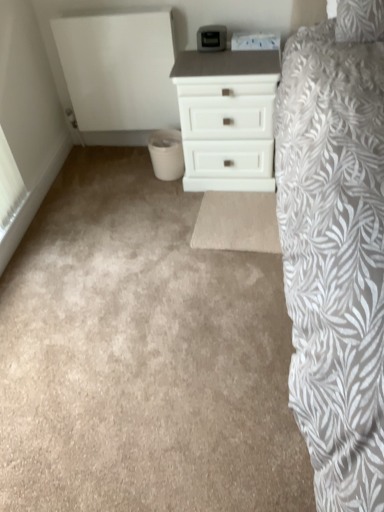
The width and height of the screenshot is (384, 512). Find the location of `white matte chest of drawers at center`. white matte chest of drawers at center is located at coordinates (227, 116).

The width and height of the screenshot is (384, 512). What do you see at coordinates (227, 116) in the screenshot?
I see `white matte chest of drawers at center` at bounding box center [227, 116].

Measure the distance between point (197,93) and camera.

Point (197,93) is 6.32 feet away from camera.

In order to click on beige carpet at center in this screenshot , I will do `click(142, 356)`.

Describe the element at coordinates (142, 356) in the screenshot. I see `beige carpet at center` at that location.

Locate an element on the screen. This screenshot has height=512, width=384. white matte chest of drawers at center is located at coordinates (227, 116).

Is beige carpet at center to the left of white matte chest of drawers at center from the viewer's perspective?

Yes.

Considering the relative positions of beige carpet at center and white matte chest of drawers at center in the image provided, is beige carpet at center behind white matte chest of drawers at center?

No, beige carpet at center is in front of white matte chest of drawers at center.

Is point (198, 435) farther from viewer compared to point (245, 91)?

No, (198, 435) is in front of (245, 91).

From the image's perspective, between beige carpet at center and white matte chest of drawers at center, which one is located above?

From the image's view, white matte chest of drawers at center is above.

From a real-world perspective, is beige carpet at center above or below white matte chest of drawers at center?

Clearly, from a real-world perspective, beige carpet at center is below white matte chest of drawers at center.

Based on the photo, which of these two, beige carpet at center or white matte chest of drawers at center, is wider?

Wider between the two is beige carpet at center.

Is beige carpet at center shorter than white matte chest of drawers at center?

Correct, beige carpet at center is not as tall as white matte chest of drawers at center.

Consider the image. Who is smaller, beige carpet at center or white matte chest of drawers at center?

Smaller between the two is white matte chest of drawers at center.

Is beige carpet at center situated inside white matte chest of drawers at center or outside?

beige carpet at center lies outside white matte chest of drawers at center.

Looking at this image, is beige carpet at center far from white matte chest of drawers at center?

They are positioned close to each other.

Is beige carpet at center facing towards white matte chest of drawers at center?

No.

What's the angular difference between beige carpet at center and white matte chest of drawers at center's facing directions?

The angle between the facing direction of beige carpet at center and the facing direction of white matte chest of drawers at center is 3.6 degrees.

This screenshot has width=384, height=512. I want to click on plain that is under the white matte chest of drawers at center (from a real-world perspective), so click(x=142, y=356).

Considering the positions of objects white matte chest of drawers at center and beige carpet at center in the image provided, who is more to the left, white matte chest of drawers at center or beige carpet at center?

beige carpet at center.

Does white matte chest of drawers at center come in front of beige carpet at center?

No, white matte chest of drawers at center is further to the viewer.

Considering the points (243, 79) and (272, 409), which point is in front, point (243, 79) or point (272, 409)?

Positioned in front is point (272, 409).

From the image's perspective, is white matte chest of drawers at center located beneath beige carpet at center?

Actually, white matte chest of drawers at center appears above beige carpet at center in the image.

In the scene shown: From a real-world perspective, is white matte chest of drawers at center physically above beige carpet at center?

Indeed, from a real-world perspective, white matte chest of drawers at center stands above beige carpet at center.

Can you confirm if white matte chest of drawers at center is thinner than beige carpet at center?

Correct, the width of white matte chest of drawers at center is less than that of beige carpet at center.

Consider the image. Considering the relative sizes of white matte chest of drawers at center and beige carpet at center in the image provided, is white matte chest of drawers at center taller than beige carpet at center?

Indeed, white matte chest of drawers at center has a greater height compared to beige carpet at center.

Is white matte chest of drawers at center bigger than beige carpet at center?

Actually, white matte chest of drawers at center might be smaller than beige carpet at center.

Choose the correct answer: Is white matte chest of drawers at center inside beige carpet at center or outside it?

white matte chest of drawers at center is not inside beige carpet at center, it's outside.

Is white matte chest of drawers at center in contact with beige carpet at center?

No, white matte chest of drawers at center is not next to beige carpet at center.

Is white matte chest of drawers at center looking in the opposite direction of beige carpet at center?

No, white matte chest of drawers at center's orientation is not away from beige carpet at center.

How different are the orientations of white matte chest of drawers at center and beige carpet at center in degrees?

3.6 degrees separate the facing orientations of white matte chest of drawers at center and beige carpet at center.

You are a GUI agent. You are given a task and a screenshot of the screen. Output one action in this format:
    pyautogui.click(x=<x>, y=<y>)
    Task: Click on the chest of drawers behind the beige carpet at center
    
    Given the screenshot: What is the action you would take?
    pyautogui.click(x=227, y=116)

In order to click on the chest of drawers above the beige carpet at center (from the image's perspective) in this screenshot , I will do `click(227, 116)`.

At what (x,y) coordinates should I click in order to perform the action: click on the chest of drawers behind the beige carpet at center. Please return your answer as a coordinate pair (x, y). The image size is (384, 512). Looking at the image, I should click on (227, 116).